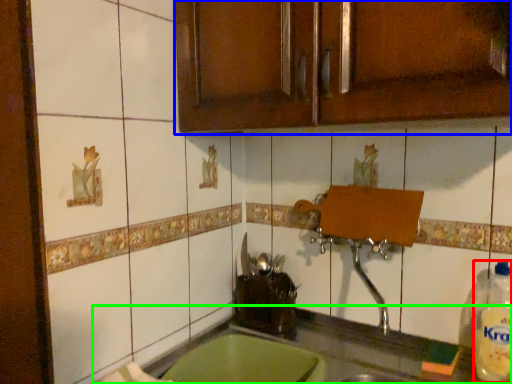
Question: Based on their relative distances, which object is nearer to bottle (highlighted by a red box)? Choose from cabinetry (highlighted by a blue box) and countertop (highlighted by a green box).

Choices:
 (A) cabinetry
 (B) countertop

Answer: (B)